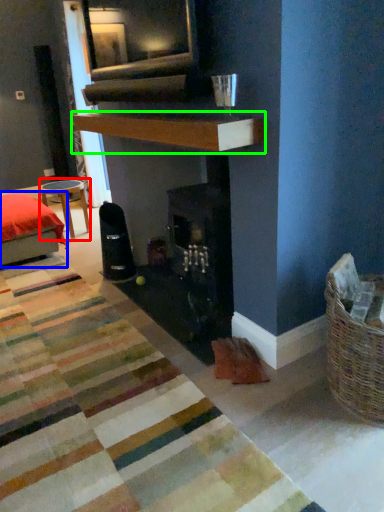
Question: Estimate the real-world distances between objects in this image. Which object is closer to table (highlighted by a red box), furniture (highlighted by a blue box) or mantle (highlighted by a green box)?

Choices:
 (A) furniture
 (B) mantle

Answer: (A)